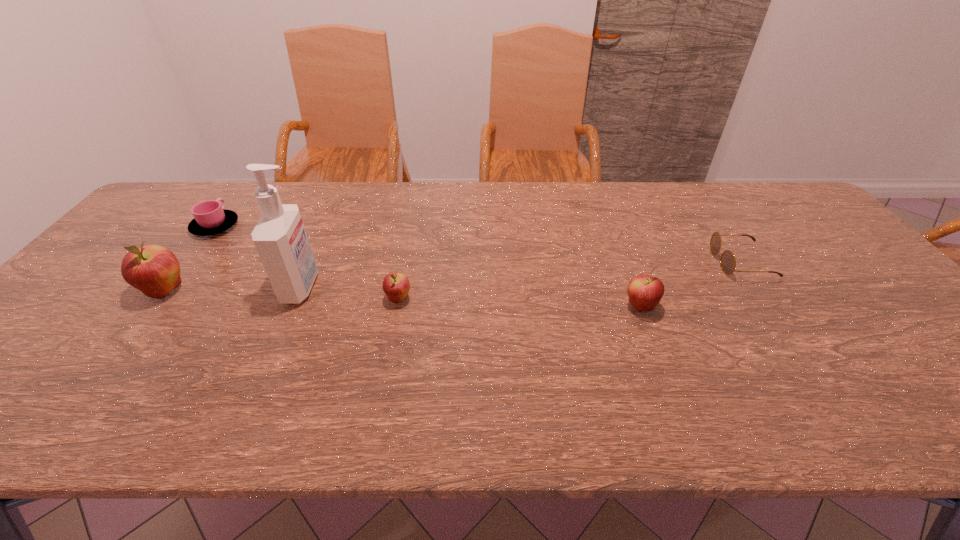
The image size is (960, 540). Find the location of `free point between the second apple from left to right and the sunglasses`. free point between the second apple from left to right and the sunglasses is located at coordinates (569, 280).

Identify the location of free spot between the tallest apple and the cleansing agent. (233, 289).

Identify the location of vacant area that lies between the sunglasses and the shortest apple. (569, 280).

Image resolution: width=960 pixels, height=540 pixels. I want to click on vacant area between the third object from right to left and the second object from right to left, so click(519, 303).

Locate an element on the screen. The width and height of the screenshot is (960, 540). vacant space in between the fourth shortest object and the fourth object from left to right is located at coordinates (519, 303).

This screenshot has width=960, height=540. What are the coordinates of `empty space that is in between the rightmost object and the leftmost apple` in the screenshot? It's located at (453, 276).

At what (x,y) coordinates should I click in order to perform the action: click on free space between the second tallest object and the sunglasses. Please return your answer as a coordinate pair (x, y). Looking at the image, I should click on (453, 276).

Where is `object that is the third closest to the third object from right to left`? object that is the third closest to the third object from right to left is located at coordinates (645, 292).

The image size is (960, 540). Identify the location of object that is the fifth closest one to the shortest apple. (727, 261).

I want to click on apple that is the closest to the sunglasses, so click(x=645, y=292).